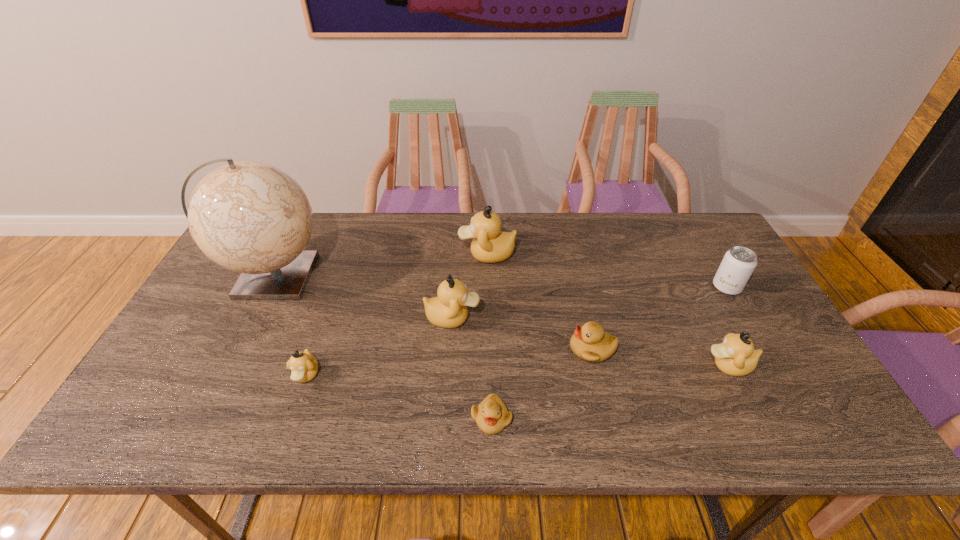
I want to click on empty location between the smaller yellow duckling and the second duckling from right to left, so click(x=541, y=384).

Locate an element on the screen. vacant area between the seventh object from right to left and the shortest object is located at coordinates (398, 397).

At what (x,y) coordinates should I click in order to perform the action: click on empty location between the leftmost tan duckling and the sixth shortest object. Please return your answer as a coordinate pair (x, y). Image resolution: width=960 pixels, height=540 pixels. Looking at the image, I should click on (379, 347).

Where is `free space that is in between the farthest duckling and the third tallest object`? This screenshot has height=540, width=960. free space that is in between the farthest duckling and the third tallest object is located at coordinates (469, 286).

Locate an element on the screen. The width and height of the screenshot is (960, 540). free area in between the second tallest duckling and the second tallest object is located at coordinates (469, 286).

At what (x,y) coordinates should I click in order to perform the action: click on free area in between the bigger yellow duckling and the rightmost object. Please return your answer as a coordinate pair (x, y). Image resolution: width=960 pixels, height=540 pixels. Looking at the image, I should click on (660, 318).

Locate an element on the screen. The width and height of the screenshot is (960, 540). free area in between the rightmost duckling and the soda can is located at coordinates (728, 327).

This screenshot has height=540, width=960. In order to click on object that is the sixth closest to the second biggest tan duckling in this screenshot , I will do `click(736, 356)`.

Find the location of a particular element. The height and width of the screenshot is (540, 960). the closest object to the soda can is located at coordinates (736, 356).

Locate which duckling is the third closest to the third biggest tan duckling. Please provide its 2D coordinates. Your answer should be formatted as a tuple, i.e. [(x, y)], where the tuple contains the x and y coordinates of a point satisfying the conditions above.

[(490, 245)]